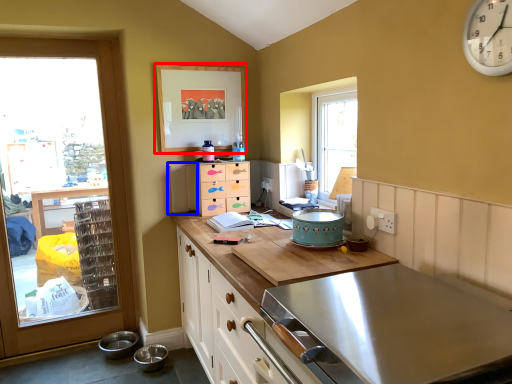
Question: Which object appears farthest to the camera in this image, picture frame (highlighted by a red box) or appliance (highlighted by a blue box)?

Choices:
 (A) picture frame
 (B) appliance

Answer: (B)